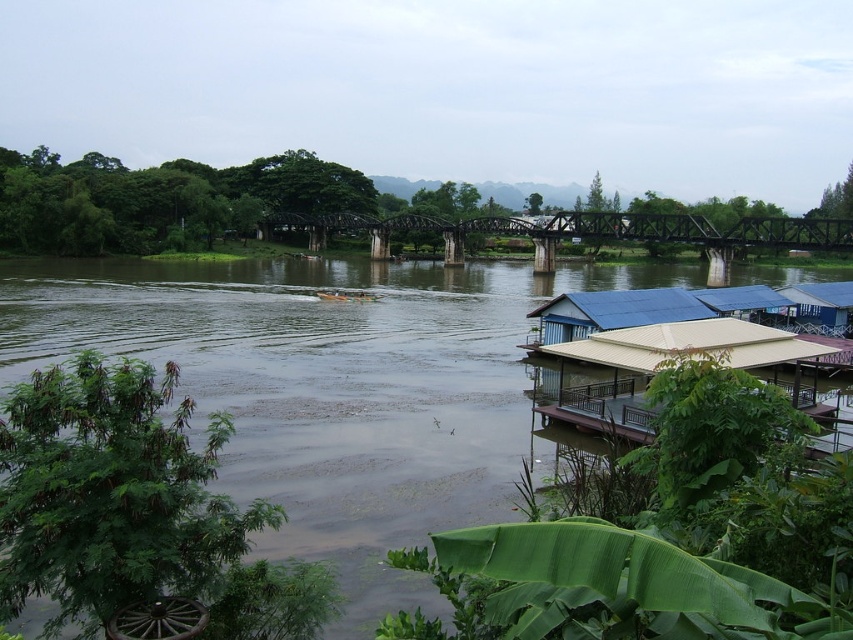
You are standing at the point marked by coordinates point (662, 365) in the riverside scene. What structure can you see directly in front of you?

The point (662, 365) marks the location of the beige corrugated roof hut at lower right, so standing there, you would be directly facing the beige corrugated roof hut at lower right.